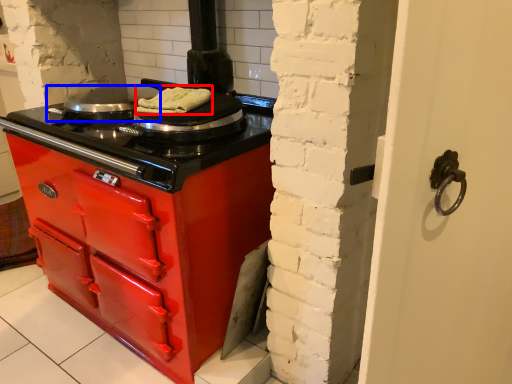
Question: Which of the following is the farthest to the observer, food (highlighted by a red box) or kitchen appliance (highlighted by a blue box)?

Choices:
 (A) food
 (B) kitchen appliance

Answer: (B)